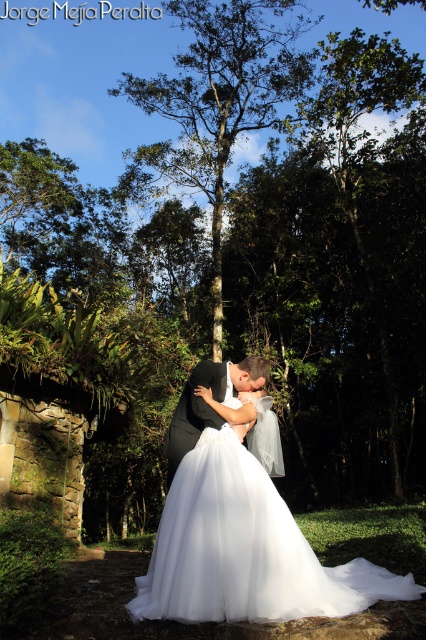
You are a photographer trying to capture a closeup shot of the couple. Since the white tulle dress at center and the black satin suit at center are both in the center, which one should you focus on to ensure the dress is fully in frame?

The white tulle dress at center has a larger size compared to the black satin suit at center, so you should focus on the white tulle dress at center to ensure the entire dress is captured in the frame.

You are a photographer trying to capture the couple in the center. Since the white tulle dress at center and the black satin suit at center are both at the center, which one is taller?

The white tulle dress at center is taller than the black satin suit at center according to the description.